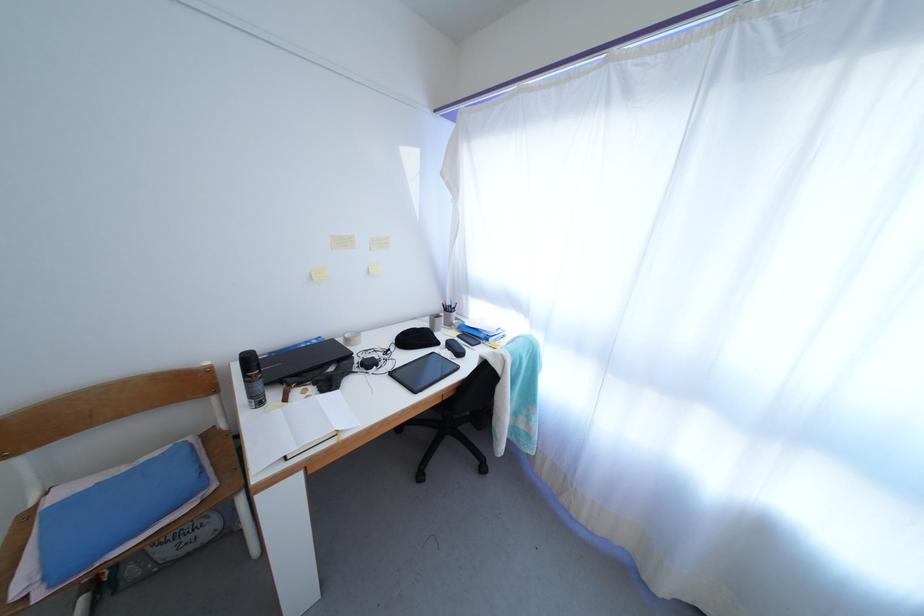
At what (x,y) coordinates should I click in order to perform the action: click on black chair sitting surface. Please return your answer as a coordinate pair (x, y). The image size is (924, 616). Looking at the image, I should click on (469, 427).